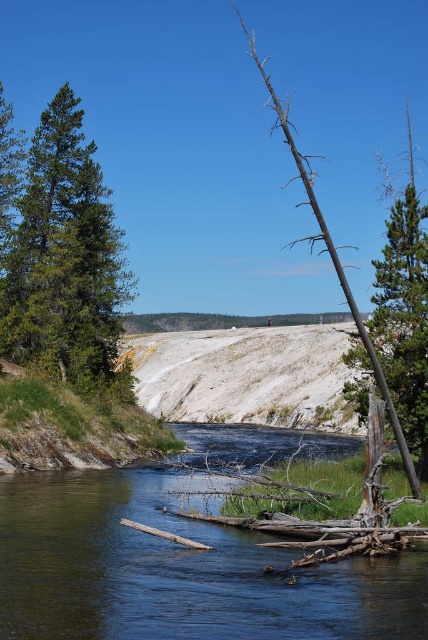
You are standing at the edge of the river and want to cross it. The clear water at center is 9 meters away from you. If you can jump 8 meters, will you be able to jump across the river?

The clear water at center is 9.00 meters away from the viewer. Since your jump reaches only 8 meters, you cannot jump across the river.

From the picture: You are an explorer trying to cross the river. You notice the green matte tree at left and the brown rough bark tree at right. Which tree is closer to you as you stand on the riverbank?

The green matte tree at left is closer to you because the brown rough bark tree at right is positioned behind it.

You are a hiker who needs to cross the river. You see the clear water at center and the brown dead wood at right. How far apart are these two landmarks?

The clear water at center and the brown dead wood at right are 113.02 feet apart from each other.